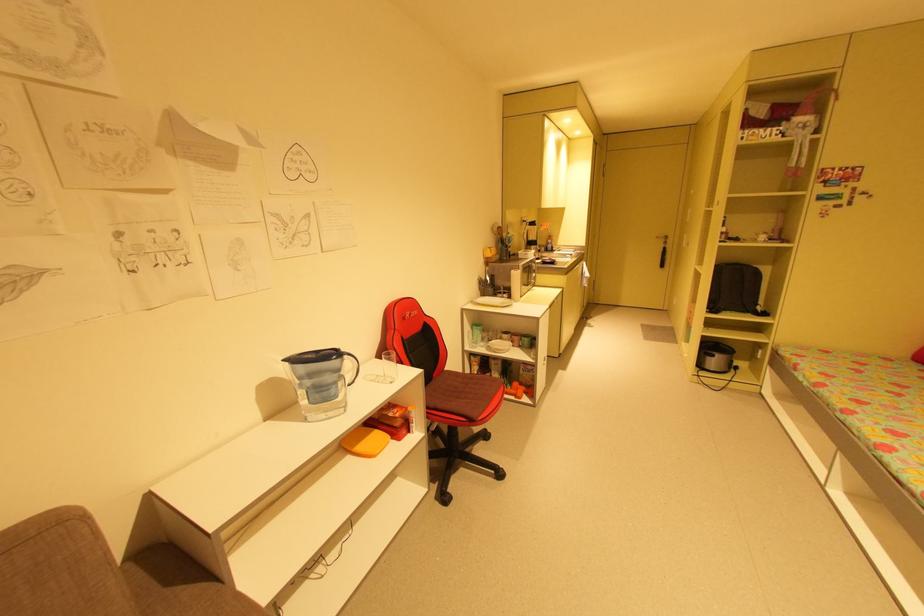
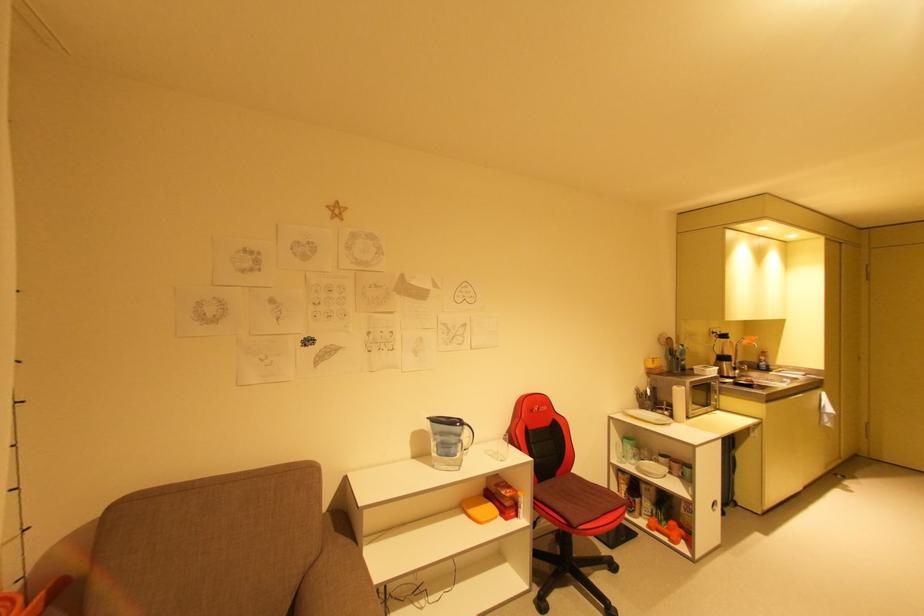
Locate, in the second image, the point that corresponds to the point at 348,357 in the first image.

(469, 427)